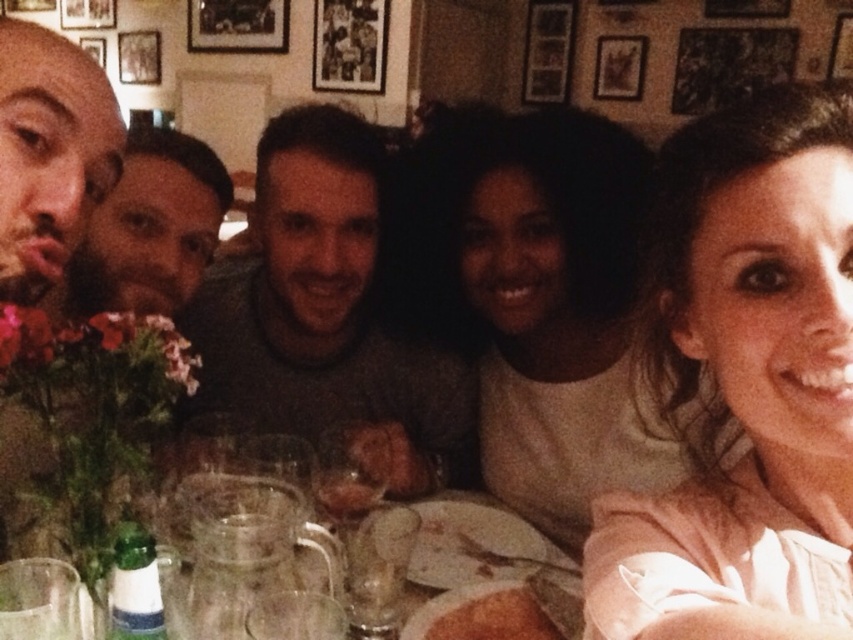
Question: Among these objects, which one is nearest to the camera?

Choices:
 (A) pink fabric shirt at upper right
 (B) light beige sweater at center

Answer: (A)

Question: Considering the real-world distances, which object is closest to the pink fabric shirt at upper right?

Choices:
 (A) brown crumbly bread at lower center
 (B) bald head at left
 (C) light beige sweater at center
 (D) dark brown hair at left

Answer: (C)

Question: Does pink fabric shirt at upper right appear under dark brown hair at left?

Choices:
 (A) yes
 (B) no

Answer: (A)

Question: Which of the following is the farthest from the observer?

Choices:
 (A) gray sweater at center
 (B) bald head at left
 (C) pink fabric shirt at upper right

Answer: (A)

Question: Is pink fabric shirt at upper right bigger than brown crumbly bread at lower center?

Choices:
 (A) yes
 (B) no

Answer: (A)

Question: Is bald head at left behind dark brown hair at left?

Choices:
 (A) no
 (B) yes

Answer: (A)